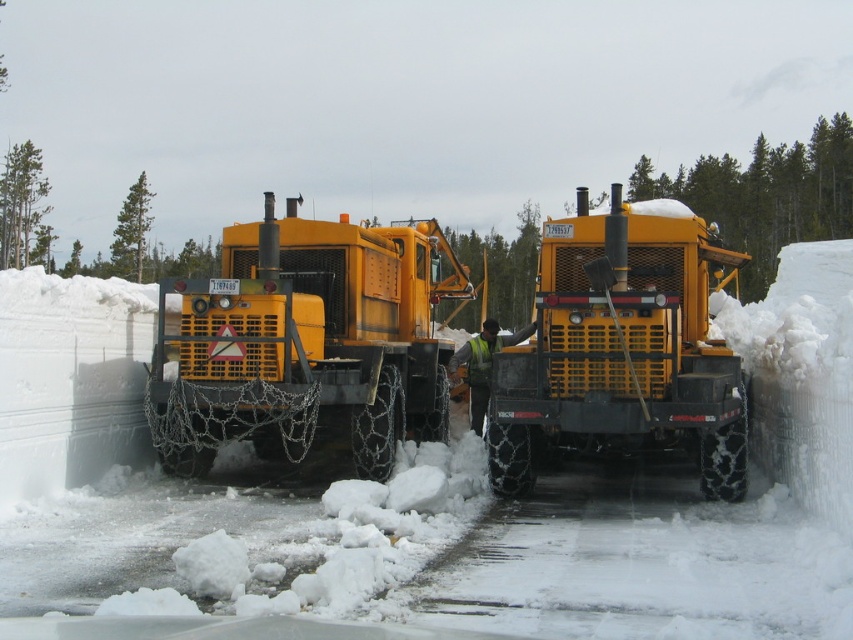
Can you confirm if white fluffy snow at center is wider than yellow matte truck at center?

Yes, white fluffy snow at center is wider than yellow matte truck at center.

Between white fluffy snow at center and yellow matte truck at center, which one appears on the left side from the viewer's perspective?

yellow matte truck at center is more to the left.

Who is more forward, (254,513) or (508,410)?

Point (254,513) is in front.

In order to click on white fluffy snow at center in this screenshot , I will do `click(515, 516)`.

Does yellow rubber truck at center appear over yellow matte truck at center?

Yes.

Is yellow rubber truck at center to the left of yellow matte truck at center from the viewer's perspective?

Yes, yellow rubber truck at center is to the left of yellow matte truck at center.

Which is behind, point (397, 333) or point (703, 358)?

The point (397, 333) is more distant.

Find the location of a particular element. yellow rubber truck at center is located at coordinates (306, 342).

Is white fluffy snow at center positioned behind yellow rubber truck at center?

No, white fluffy snow at center is in front of yellow rubber truck at center.

Between white fluffy snow at center and yellow rubber truck at center, which one appears on the left side from the viewer's perspective?

Positioned to the left is yellow rubber truck at center.

Between point (695, 531) and point (334, 317), which one is positioned behind?

Positioned behind is point (334, 317).

Where is `white fluffy snow at center`? white fluffy snow at center is located at coordinates (515, 516).